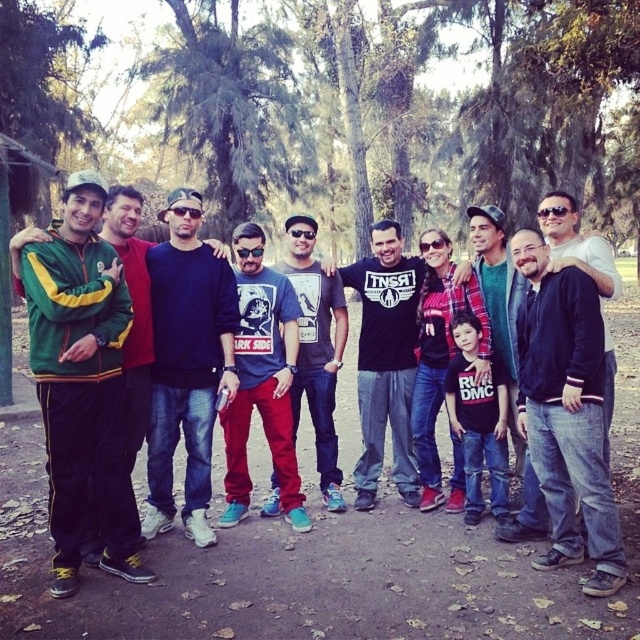
Who is positioned more to the right, black cotton jacket at center or black t-shirt at center?

Positioned to the right is black cotton jacket at center.

Does black cotton jacket at center have a lesser width compared to black t-shirt at center?

Indeed, black cotton jacket at center has a lesser width compared to black t-shirt at center.

Between point (566, 371) and point (397, 452), which one is positioned behind?

Positioned behind is point (397, 452).

You are a GUI agent. You are given a task and a screenshot of the screen. Output one action in this format:
    pyautogui.click(x=<x>, y=<y>)
    Task: Click on the black cotton jacket at center
    This screenshot has width=640, height=640.
    Given the screenshot: What is the action you would take?
    pyautogui.click(x=566, y=412)

Who is more distant from viewer, (237, 348) or (108, 220)?

The point (237, 348) is more distant.

Does dark gray cotton t-shirt at center appear on the left side of green/yellow track suit at left?

Incorrect, dark gray cotton t-shirt at center is not on the left side of green/yellow track suit at left.

Where is `dark gray cotton t-shirt at center`? dark gray cotton t-shirt at center is located at coordinates (260, 380).

Between dark blue sweater at center and dark gray cotton t-shirt at center, which one has more height?

dark blue sweater at center is taller.

Is point (180, 337) less distant than point (285, 365)?

Yes.

Image resolution: width=640 pixels, height=640 pixels. I want to click on dark blue sweater at center, so click(186, 364).